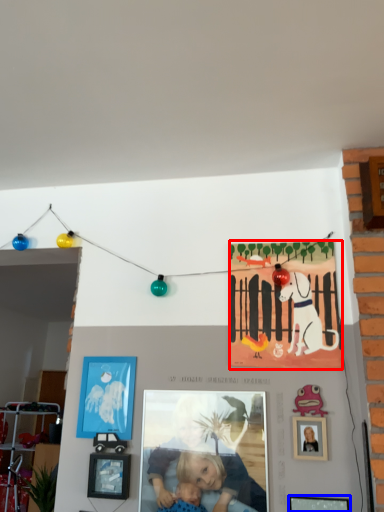
Question: Which object appears farthest to the camera in this image, poster (highlighted by a red box) or picture frame (highlighted by a blue box)?

Choices:
 (A) poster
 (B) picture frame

Answer: (A)